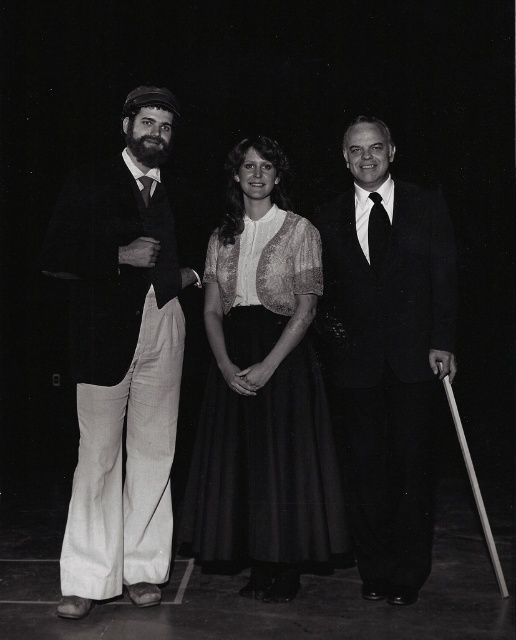
Based on the scene description, which object is shorter in height between the matte white blouse at center and the matte black dress at center?

The matte white blouse at center is shorter in height compared to the matte black dress at center.

You are a costume designer preparing for a play and need to ensure that the white cotton pants at left and the matte white blouse at center fit within the stage lighting. Which item has a narrower silhouette when viewed from the front?

The white cotton pants at left has a lesser width compared to the matte white blouse at center, so the white cotton pants at left has a narrower silhouette when viewed from the front.

You are organizing a photoshoot and need to arrange the white cotton pants at left and the smooth black suit at center in a display case. The display case has limited space. Based on the image, which item should you prioritize placing first to ensure both fit?

The white cotton pants at left occupies less space than smooth black suit at center, so you should prioritize placing the smooth black suit at center first to accommodate its larger size before the smaller white cotton pants at left.